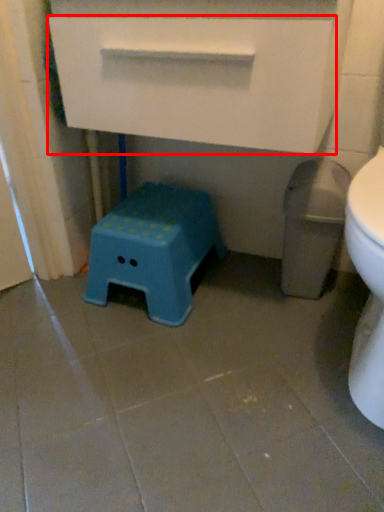
Question: From the image's perspective, where is drawer (annotated by the red box) located in relation to stool in the image?

Choices:
 (A) below
 (B) above

Answer: (B)